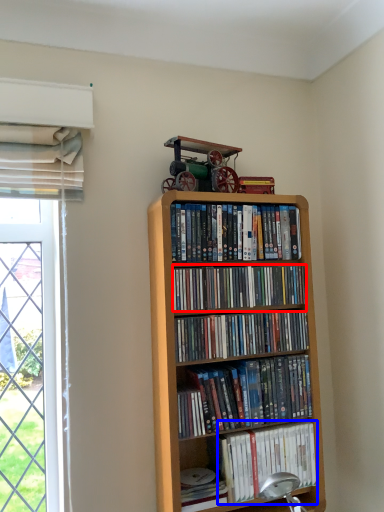
Question: Which object appears farthest to the camera in this image, book (highlighted by a red box) or book (highlighted by a blue box)?

Choices:
 (A) book
 (B) book

Answer: (B)